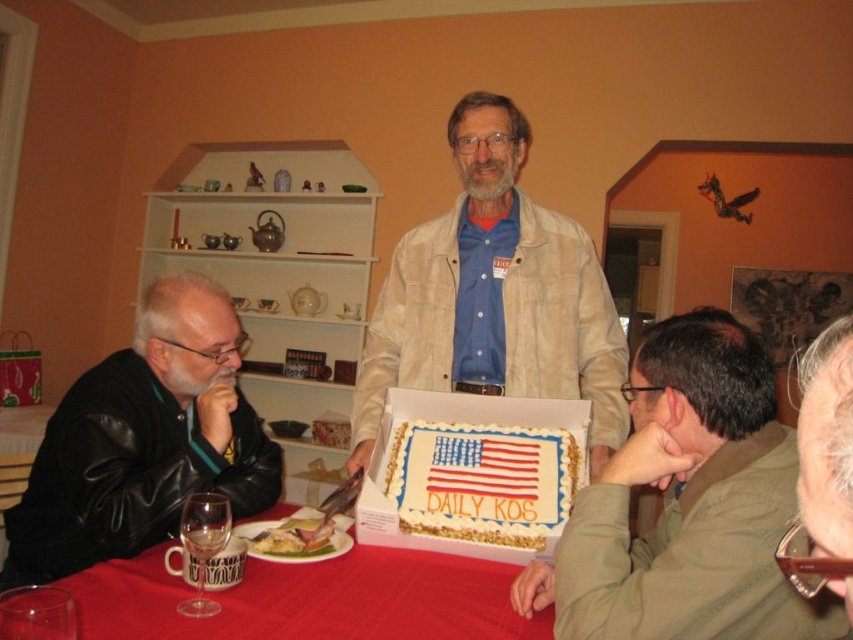
Which is in front, point (630, 529) or point (36, 481)?

Point (36, 481) is more forward.

Does point (785, 609) come farther from viewer compared to point (80, 556)?

That is False.

Identify the location of matte khaki shirt at lower right. This screenshot has width=853, height=640. (686, 504).

Who is shorter, matte khaki shirt at lower right or light beige jacket at center?

matte khaki shirt at lower right

Based on the photo, does matte khaki shirt at lower right have a greater width compared to light beige jacket at center?

No.

What do you see at coordinates (686, 504) in the screenshot?
I see `matte khaki shirt at lower right` at bounding box center [686, 504].

Identify the location of matte khaki shirt at lower right. This screenshot has width=853, height=640. (686, 504).

Does light beige jacket at center have a lesser width compared to white frosted cake with american flag design at center?

In fact, light beige jacket at center might be wider than white frosted cake with american flag design at center.

Is light beige jacket at center taller than white frosted cake with american flag design at center?

Correct, light beige jacket at center is much taller as white frosted cake with american flag design at center.

The image size is (853, 640). Find the location of `light beige jacket at center`. light beige jacket at center is located at coordinates point(494,296).